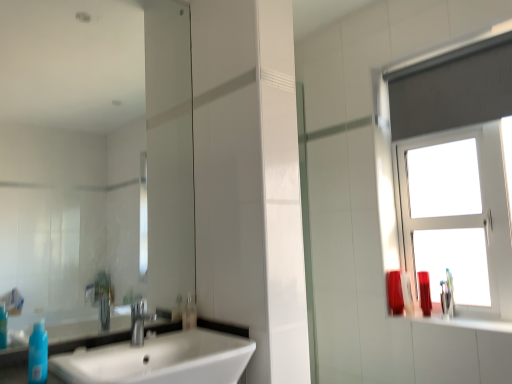
Question: From a real-world perspective, is white glass window at upper right below matte plastic container at right, which is the third toiletry in front-to-back order?

Choices:
 (A) no
 (B) yes

Answer: (A)

Question: Would you consider white glass window at upper right to be distant from matte plastic container at right, which is the third toiletry in front-to-back order?

Choices:
 (A) yes
 (B) no

Answer: (B)

Question: Does white glass window at upper right have a greater height compared to matte plastic container at right, which is counted as the third toiletry, starting from the left?

Choices:
 (A) no
 (B) yes

Answer: (B)

Question: Is white glass window at upper right bigger than matte plastic container at right, placed as the 2th toiletry when sorted from right to left?

Choices:
 (A) no
 (B) yes

Answer: (B)

Question: Is matte plastic container at right, which is counted as the third toiletry, starting from the left, located within white glass window at upper right?

Choices:
 (A) no
 (B) yes

Answer: (A)

Question: Is matte plastic container at right, placed as the 2th toiletry when sorted from right to left, taller or shorter than white glossy sink at lower left?

Choices:
 (A) tall
 (B) short

Answer: (A)

Question: Considering the positions of matte plastic container at right, placed as the 2th toiletry when sorted from right to left, and white glossy sink at lower left in the image, is matte plastic container at right, placed as the 2th toiletry when sorted from right to left, bigger or smaller than white glossy sink at lower left?

Choices:
 (A) big
 (B) small

Answer: (B)

Question: Is matte plastic container at right, placed as the 2th toiletry when sorted from right to left, situated inside white glossy sink at lower left or outside?

Choices:
 (A) inside
 (B) outside

Answer: (B)

Question: From a real-world perspective, is matte plastic container at right, acting as the second toiletry starting from the back, positioned above or below white glossy sink at lower left?

Choices:
 (A) above
 (B) below

Answer: (A)

Question: Is white glass window at upper right spatially inside shiny plastic bottle at right, which is the 4th toiletry in left-to-right order, or outside of it?

Choices:
 (A) outside
 (B) inside

Answer: (A)

Question: Visually, is white glass window at upper right positioned to the left or to the right of shiny plastic bottle at right, which is the 4th toiletry in left-to-right order?

Choices:
 (A) left
 (B) right

Answer: (B)

Question: From the image's perspective, is white glass window at upper right located above or below shiny plastic bottle at right, which is the 4th toiletry in left-to-right order?

Choices:
 (A) below
 (B) above

Answer: (B)

Question: In the image, is white glass window at upper right positioned in front of or behind shiny plastic bottle at right, the 1th toiletry in the right-to-left sequence?

Choices:
 (A) front
 (B) behind

Answer: (A)

Question: Does point (34, 329) appear closer or farther from the camera than point (131, 345)?

Choices:
 (A) closer
 (B) farther

Answer: (A)

Question: Is blue matte bottle at lower left taller or shorter than white glossy sink at lower left?

Choices:
 (A) short
 (B) tall

Answer: (A)